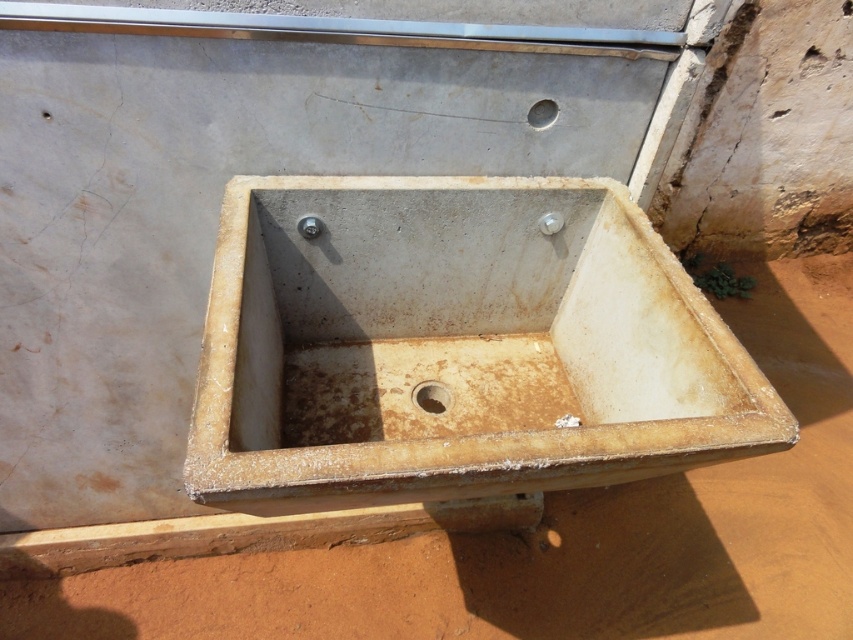
Question: Does rusty concrete sink at center have a lesser width compared to rusty metal drain at center?

Choices:
 (A) yes
 (B) no

Answer: (B)

Question: Which object appears closest to the camera in this image?

Choices:
 (A) rusty concrete sink at center
 (B) rusty metal drain at center

Answer: (A)

Question: Which point is farther to the camera?

Choices:
 (A) (424, 406)
 (B) (347, 460)

Answer: (A)

Question: From the image, what is the correct spatial relationship of rusty concrete sink at center in relation to rusty metal drain at center?

Choices:
 (A) left
 (B) right

Answer: (B)

Question: Can you confirm if rusty concrete sink at center is smaller than rusty metal drain at center?

Choices:
 (A) yes
 (B) no

Answer: (B)